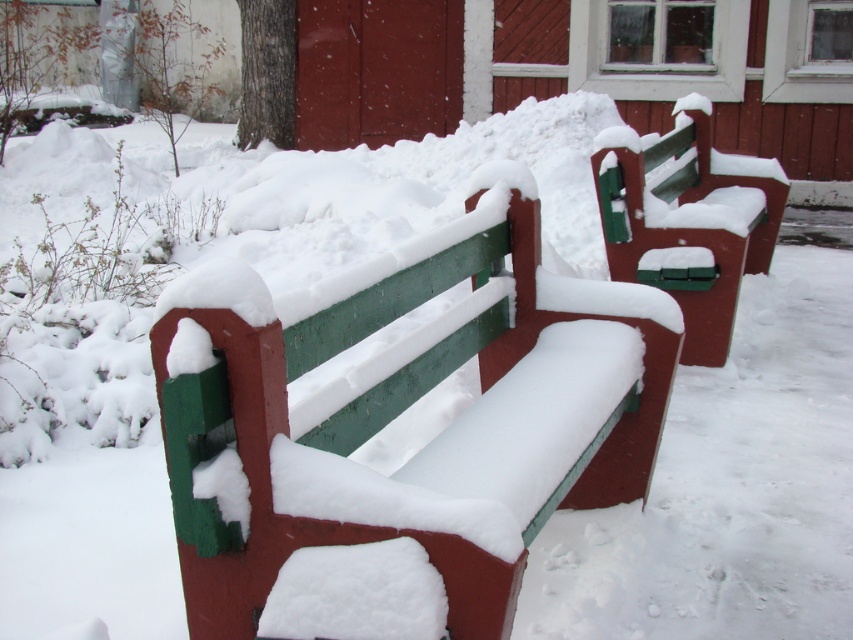
Question: Is green painted wood bench at center wider than green matte bench at center?

Choices:
 (A) no
 (B) yes

Answer: (A)

Question: Is green painted wood bench at center closer to camera compared to green matte bench at center?

Choices:
 (A) yes
 (B) no

Answer: (A)

Question: Is green painted wood bench at center to the left of green matte bench at center from the viewer's perspective?

Choices:
 (A) yes
 (B) no

Answer: (A)

Question: Which point appears closest to the camera in this image?

Choices:
 (A) (380, 627)
 (B) (595, 141)

Answer: (A)

Question: Which of the following is the closest to the observer?

Choices:
 (A) (577, 356)
 (B) (625, 244)

Answer: (A)

Question: Which point is closer to the camera?

Choices:
 (A) green painted wood bench at center
 (B) green matte bench at center

Answer: (A)